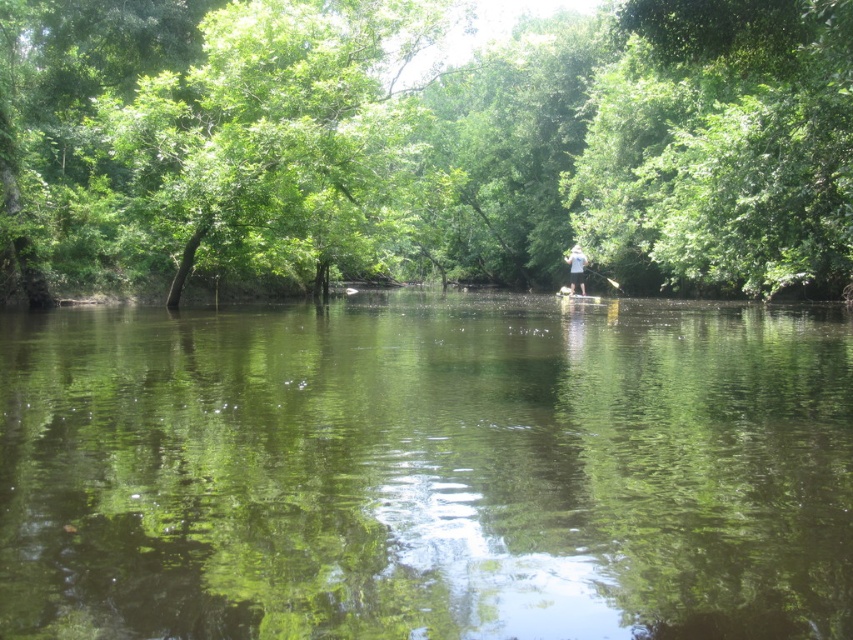
Question: In this image, where is green reflective water at center located relative to white plastic paddle at center?

Choices:
 (A) below
 (B) above

Answer: (A)

Question: From the image, what is the correct spatial relationship of green reflective water at center in relation to white plastic paddle at center?

Choices:
 (A) left
 (B) right

Answer: (A)

Question: Estimate the real-world distances between objects in this image. Which object is closer to the green leafy tree at center?

Choices:
 (A) green reflective water at center
 (B) white cotton shirt at center

Answer: (B)

Question: Which is farther from the green leafy tree at center?

Choices:
 (A) green reflective water at center
 (B) white plastic paddle at center

Answer: (A)

Question: Can you confirm if white cotton shirt at center is bigger than white plastic paddle at center?

Choices:
 (A) yes
 (B) no

Answer: (A)

Question: Which point is closer to the camera taking this photo?

Choices:
 (A) (334, 595)
 (B) (576, 248)
 (C) (593, 269)

Answer: (A)